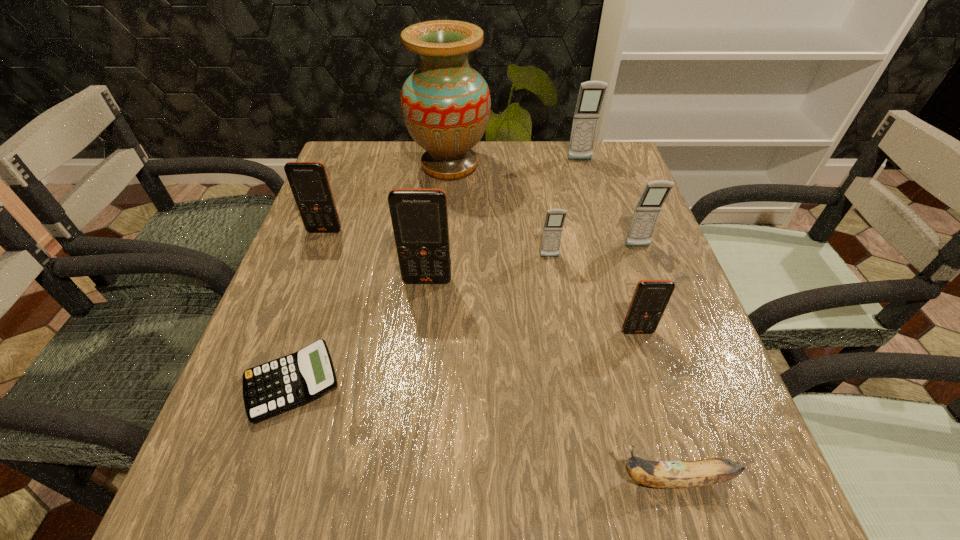
Where is `vase`? The image size is (960, 540). vase is located at coordinates (445, 103).

The height and width of the screenshot is (540, 960). I want to click on the farthest gray cellular telephone, so click(591, 94).

Where is `the second gray cellular telephone from left to right`? The width and height of the screenshot is (960, 540). the second gray cellular telephone from left to right is located at coordinates (591, 94).

Locate an element on the screen. This screenshot has width=960, height=540. the second cellular telephone from left to right is located at coordinates (419, 217).

The image size is (960, 540). In order to click on the fifth farthest cellular telephone in this screenshot , I will do `click(419, 217)`.

The image size is (960, 540). I want to click on the second farthest gray cellular telephone, so 647,211.

In order to click on the fourth farthest object in this screenshot , I will do `click(647, 211)`.

Where is `the farthest orange cellular telephone`? the farthest orange cellular telephone is located at coordinates (309, 183).

Image resolution: width=960 pixels, height=540 pixels. Find the location of `the leftmost orange cellular telephone`. the leftmost orange cellular telephone is located at coordinates (309, 183).

Identify the location of the rightmost orange cellular telephone. Image resolution: width=960 pixels, height=540 pixels. (650, 299).